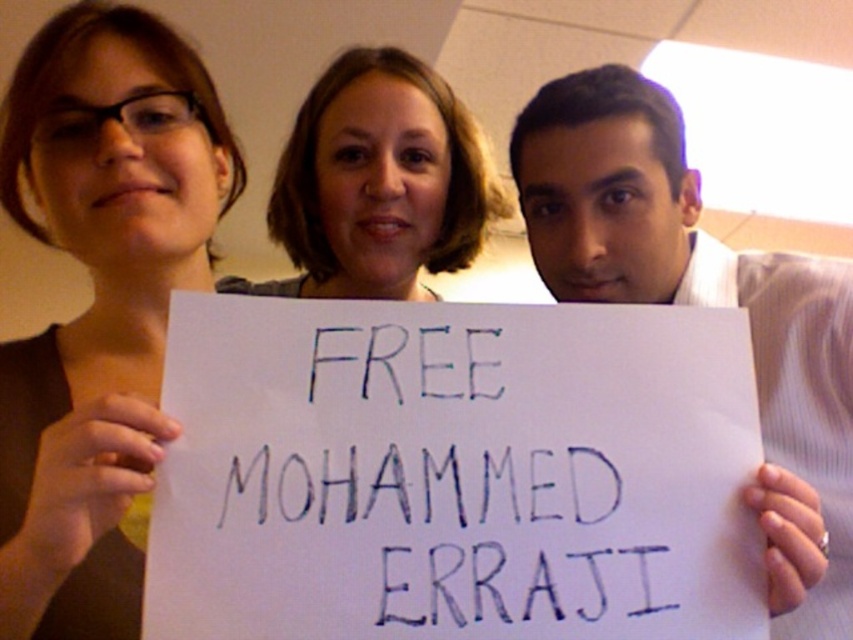
You are a photographer trying to capture a clear shot of the white paper sign at center and the smooth brown hair at center. Given that your camera can only focus on objects within 20 centimeters of each other, will both objects be in focus?

The white paper sign at center and smooth brown hair at center are 21.39 centimeters apart from each other. Since the distance between them exceeds the camera focus range of 20 centimeters, both objects cannot be in focus simultaneously.

You are a photographer trying to capture a clear shot of the white paper sign at center and the smooth brown hair at center. Based on their sizes in the image, which object would appear larger in your photo?

The white paper sign at center appears larger in the photo because it is taller than the smooth brown hair at center.